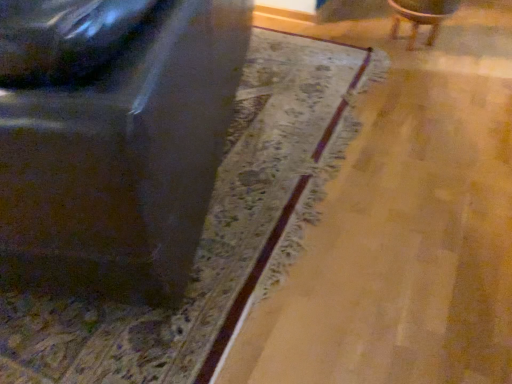
Question: Can you confirm if wooden chair at upper right, acting as the 2th chair starting from the left, is smaller than metallic silver chair at left, which is the second chair in right-to-left order?

Choices:
 (A) no
 (B) yes

Answer: (B)

Question: Is wooden chair at upper right, acting as the 2th chair starting from the left, taller than metallic silver chair at left, which is the second chair in right-to-left order?

Choices:
 (A) yes
 (B) no

Answer: (B)

Question: Is wooden chair at upper right, acting as the 2th chair starting from the left, further to the viewer compared to metallic silver chair at left, which is the second chair in right-to-left order?

Choices:
 (A) yes
 (B) no

Answer: (A)

Question: From a real-world perspective, does wooden chair at upper right, the first chair in the right-to-left sequence, sit lower than metallic silver chair at left, which is the second chair in right-to-left order?

Choices:
 (A) no
 (B) yes

Answer: (B)

Question: Is wooden chair at upper right, the first chair in the right-to-left sequence, closer to camera compared to metallic silver chair at left, which is counted as the 1th chair, starting from the left?

Choices:
 (A) no
 (B) yes

Answer: (A)

Question: Is wooden chair at upper right, the first chair in the right-to-left sequence, completely or partially outside of metallic silver chair at left, which is the second chair in right-to-left order?

Choices:
 (A) no
 (B) yes

Answer: (B)

Question: Does metallic silver chair at left, which is counted as the 1th chair, starting from the left, have a smaller size compared to wooden chair at upper right, acting as the 2th chair starting from the left?

Choices:
 (A) no
 (B) yes

Answer: (A)

Question: Considering the relative sizes of metallic silver chair at left, which is the second chair in right-to-left order, and wooden chair at upper right, the first chair in the right-to-left sequence, in the image provided, is metallic silver chair at left, which is the second chair in right-to-left order, wider than wooden chair at upper right, the first chair in the right-to-left sequence,?

Choices:
 (A) yes
 (B) no

Answer: (A)

Question: Does metallic silver chair at left, which is the second chair in right-to-left order, turn towards wooden chair at upper right, acting as the 2th chair starting from the left?

Choices:
 (A) yes
 (B) no

Answer: (B)

Question: Is metallic silver chair at left, which is counted as the 1th chair, starting from the left, at the left side of wooden chair at upper right, the first chair in the right-to-left sequence?

Choices:
 (A) yes
 (B) no

Answer: (A)

Question: Is metallic silver chair at left, which is the second chair in right-to-left order, facing away from wooden chair at upper right, acting as the 2th chair starting from the left?

Choices:
 (A) yes
 (B) no

Answer: (A)

Question: Is there a large distance between metallic silver chair at left, which is counted as the 1th chair, starting from the left, and wooden chair at upper right, the first chair in the right-to-left sequence?

Choices:
 (A) no
 (B) yes

Answer: (B)

Question: Considering the positions of metallic silver chair at left, which is the second chair in right-to-left order, and wooden chair at upper right, acting as the 2th chair starting from the left, in the image, is metallic silver chair at left, which is the second chair in right-to-left order, bigger or smaller than wooden chair at upper right, acting as the 2th chair starting from the left,?

Choices:
 (A) small
 (B) big

Answer: (B)